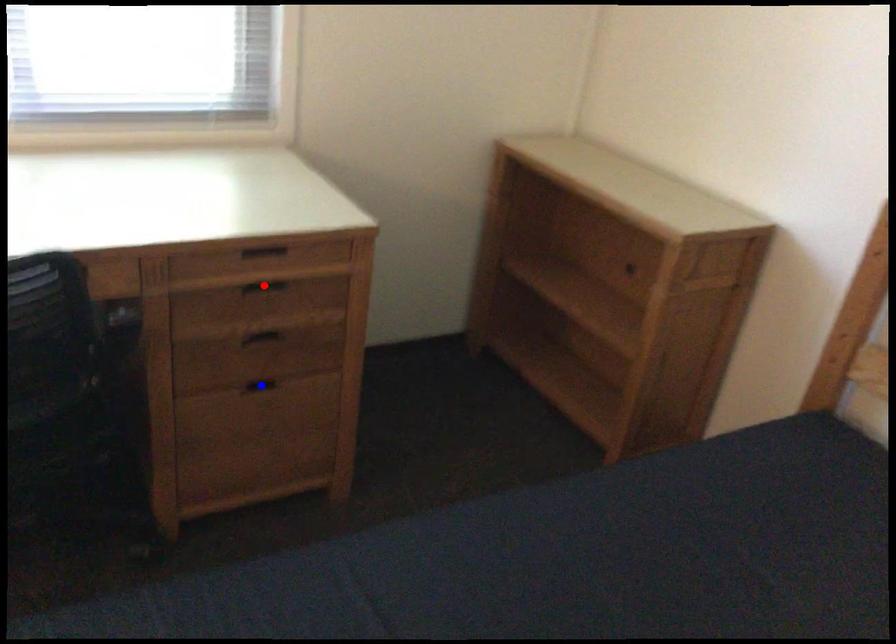
Question: Two points are marked on the image. Which point is closer to the camera?

Choices:
 (A) Blue point is closer.
 (B) Red point is closer.

Answer: (B)